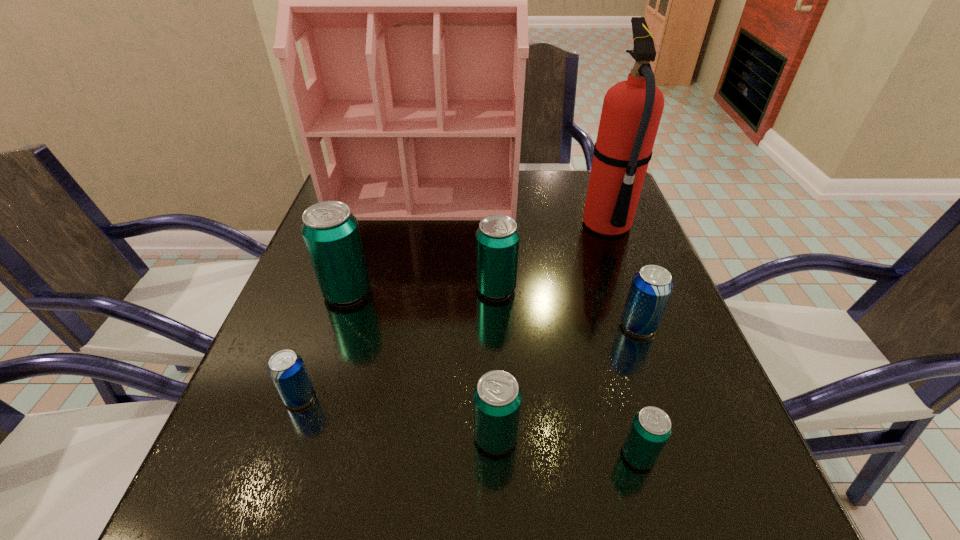
At what (x,y) coordinates should I click in order to perform the action: click on free region located 0.390m on the left of the third biggest teal beer can. Please return your answer as a coordinate pair (x, y). Looking at the image, I should click on (225, 436).

Locate an element on the screen. free region located on the back of the sixth farthest object is located at coordinates (349, 253).

You are a GUI agent. You are given a task and a screenshot of the screen. Output one action in this format:
    pyautogui.click(x=<x>, y=<y>)
    Task: Click on the free space located 0.090m on the left of the second beer can from right to left
    
    Given the screenshot: What is the action you would take?
    pyautogui.click(x=562, y=455)

This screenshot has width=960, height=540. In order to click on dollhouse present at the far edge in this screenshot , I will do `click(410, 0)`.

I want to click on fire extinguisher present at the far edge, so click(632, 109).

Locate an element on the screen. dollhouse that is at the left edge is located at coordinates (410, 0).

The width and height of the screenshot is (960, 540). Identify the location of fire extinguisher located at the right edge. (632, 109).

In order to click on object at the far left corner in this screenshot , I will do `click(410, 0)`.

Where is `object at the far right corner`? object at the far right corner is located at coordinates click(632, 109).

The image size is (960, 540). What are the coordinates of `free region at the far edge of the desktop` in the screenshot? It's located at (528, 185).